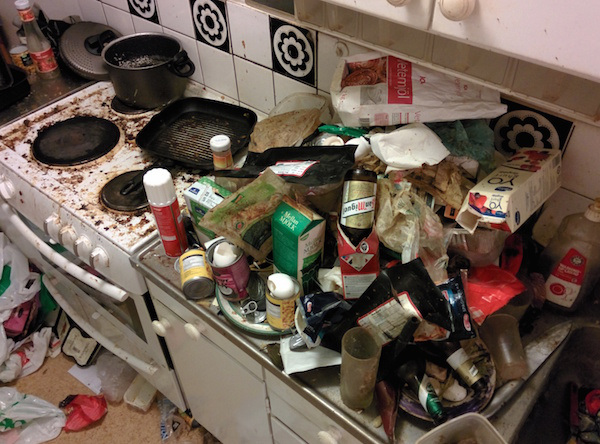
This screenshot has width=600, height=444. Find the location of `drawers`. drawers is located at coordinates (288, 414), (246, 361).